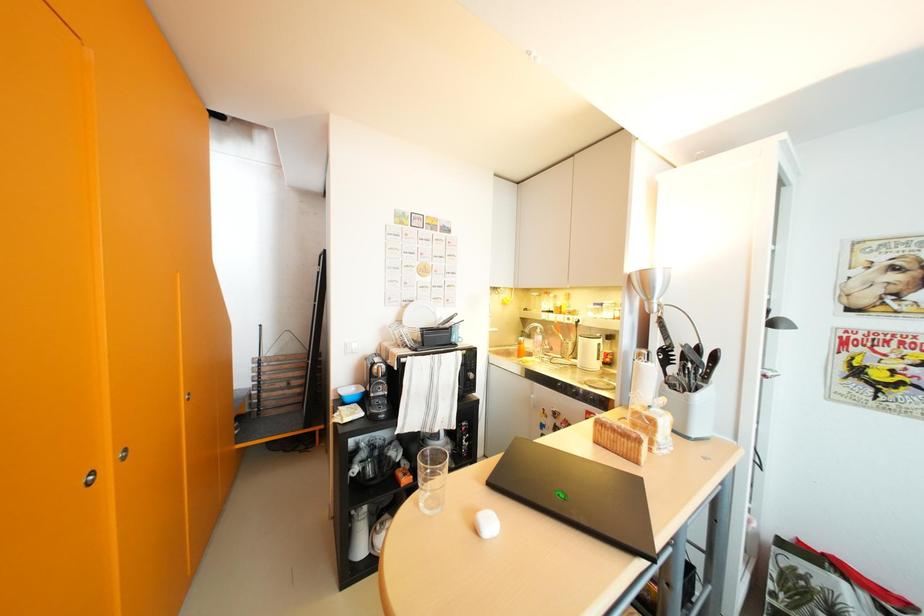
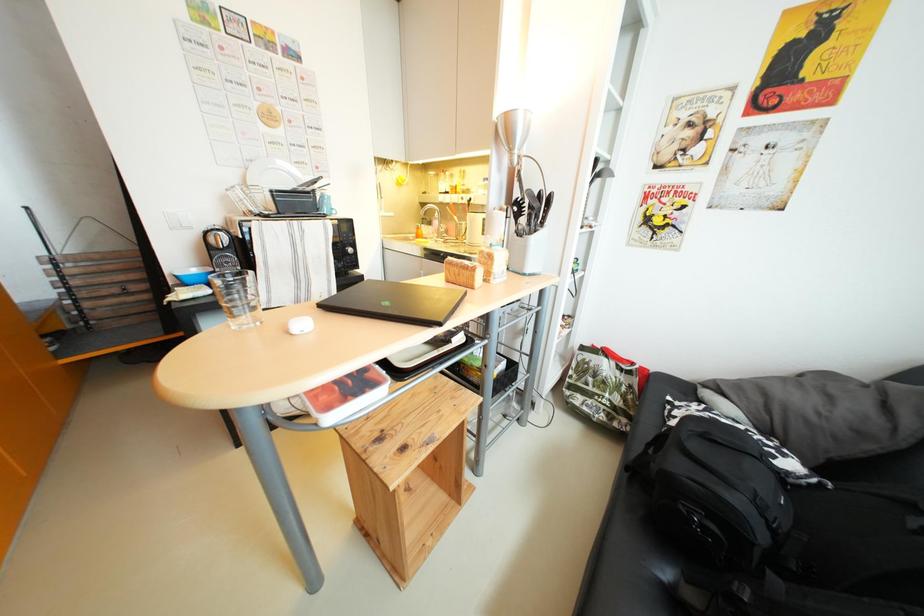
The images are taken continuously from a first-person perspective. In which direction is your viewpoint rotating?

The camera's rotation is toward right-down.